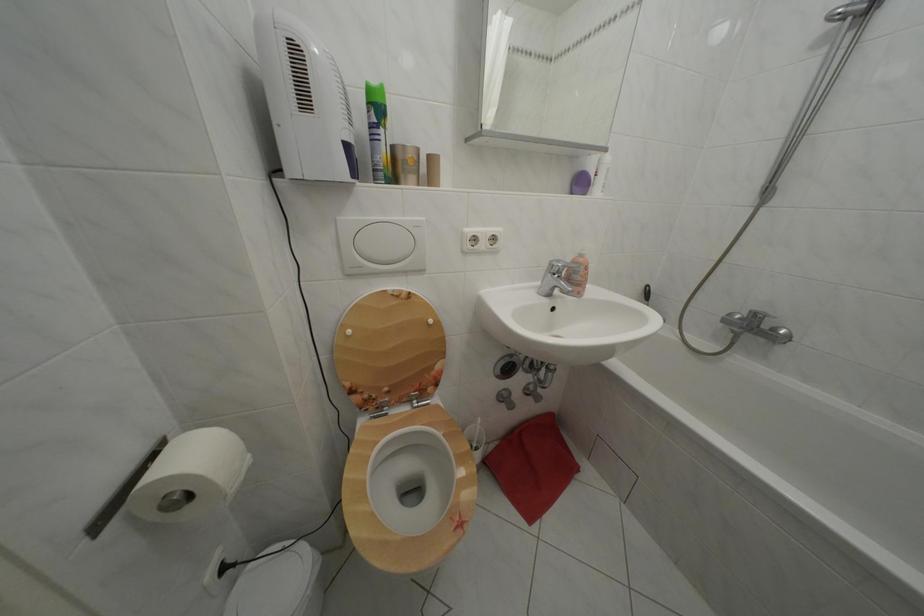
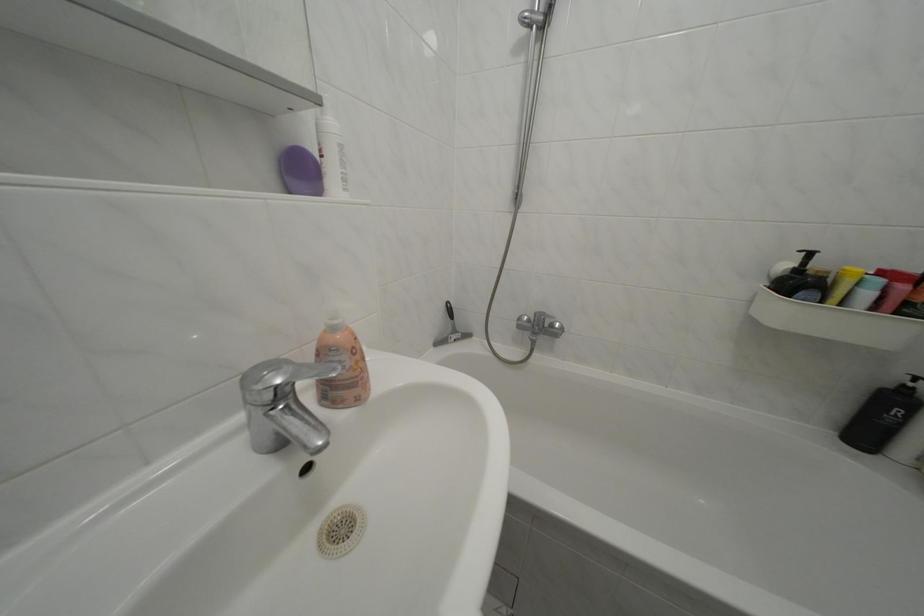
The point at [590,262] is marked in the first image. Where is the corresponding point in the second image?

(342, 334)